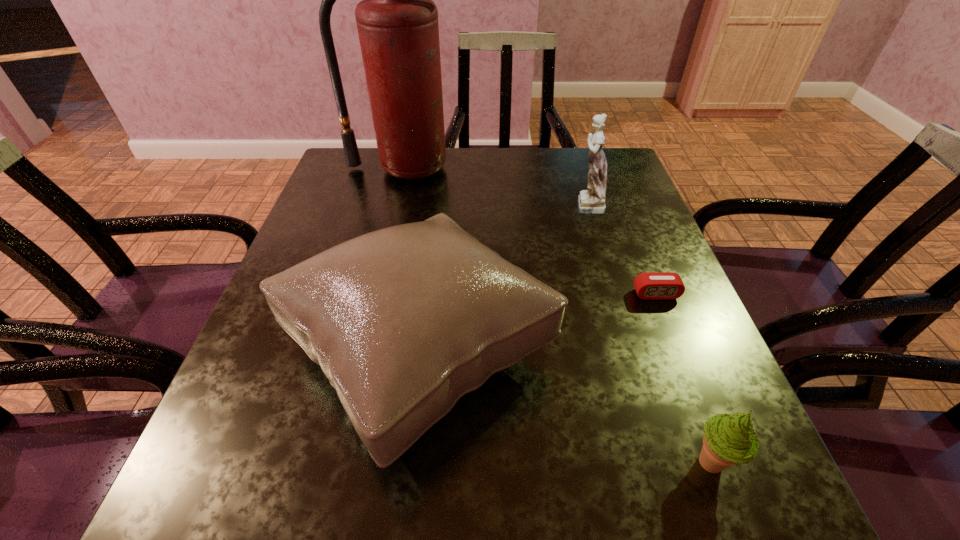
I want to click on unoccupied area between the alarm clock and the figurine, so click(x=621, y=249).

Locate an element on the screen. Image resolution: width=960 pixels, height=540 pixels. vacant space in between the alarm clock and the icecream is located at coordinates (684, 379).

Identify the location of object that is the third nearest to the cushion. (591, 201).

Point out which object is positioned as the second nearest to the fire extinguisher. Please provide its 2D coordinates. Your answer should be formatted as a tuple, i.e. [(x, y)], where the tuple contains the x and y coordinates of a point satisfying the conditions above.

[(403, 321)]

Locate an element on the screen. vacant space that satisfies the following two spatial constraints: 1. on the front-facing side of the icecream; 2. on the right side of the second farthest object is located at coordinates (663, 463).

Identify the location of vacant area that satisfies the following two spatial constraints: 1. on the front-facing side of the figurine; 2. on the right side of the icecream. The width and height of the screenshot is (960, 540). (663, 463).

At what (x,y) coordinates should I click in order to perform the action: click on vacant position in the image that satisfies the following two spatial constraints: 1. on the front-facing side of the fourth nearest object; 2. on the left side of the second shortest object. Please return your answer as a coordinate pair (x, y). Looking at the image, I should click on (663, 463).

The image size is (960, 540). Identify the location of vacant region that satisfies the following two spatial constraints: 1. on the front-facing side of the second farthest object; 2. on the back side of the second shortest object. (663, 463).